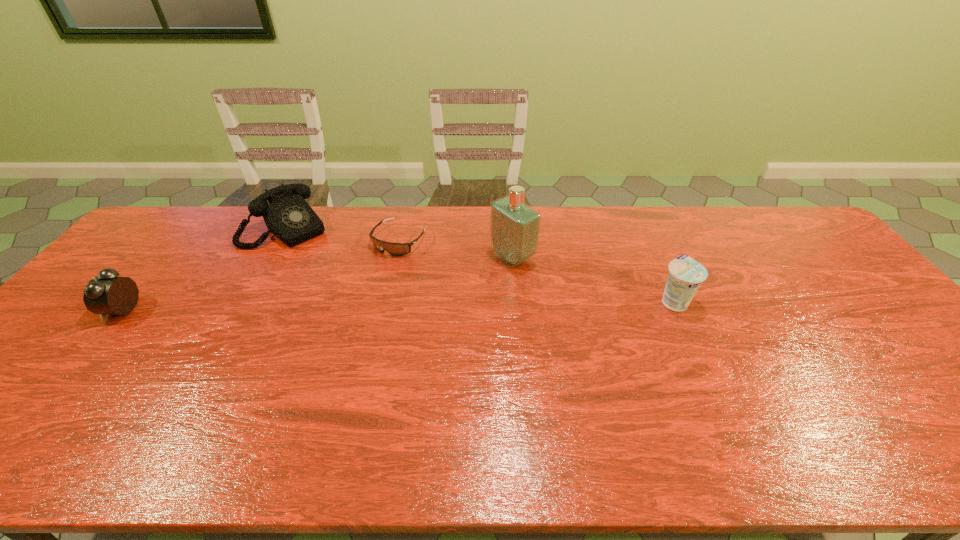
You are a GUI agent. You are given a task and a screenshot of the screen. Output one action in this format:
    pyautogui.click(x=<x>, y=<y>)
    Task: Click on the alarm clock
    The width and height of the screenshot is (960, 540).
    Given the screenshot: What is the action you would take?
    pyautogui.click(x=106, y=294)

I want to click on the rightmost object, so click(685, 276).

I want to click on the tallest object, so click(x=514, y=230).

Where is `perfume`? The height and width of the screenshot is (540, 960). perfume is located at coordinates (514, 230).

You are a GUI agent. You are given a task and a screenshot of the screen. Output one action in this format:
    pyautogui.click(x=<x>, y=<y>)
    Task: Click on the goggles
    
    Given the screenshot: What is the action you would take?
    pyautogui.click(x=395, y=249)

Where is `the shortest object`? the shortest object is located at coordinates (395, 249).

This screenshot has width=960, height=540. Identify the location of the second object from left to right. (288, 216).

Identify the location of free point located 0.260m on the back of the rightmost object. This screenshot has width=960, height=540. (643, 234).

Image resolution: width=960 pixels, height=540 pixels. I want to click on free space located on the front label of the tallest object, so click(420, 308).

The width and height of the screenshot is (960, 540). I want to click on free space located on the front label of the tallest object, so click(438, 298).